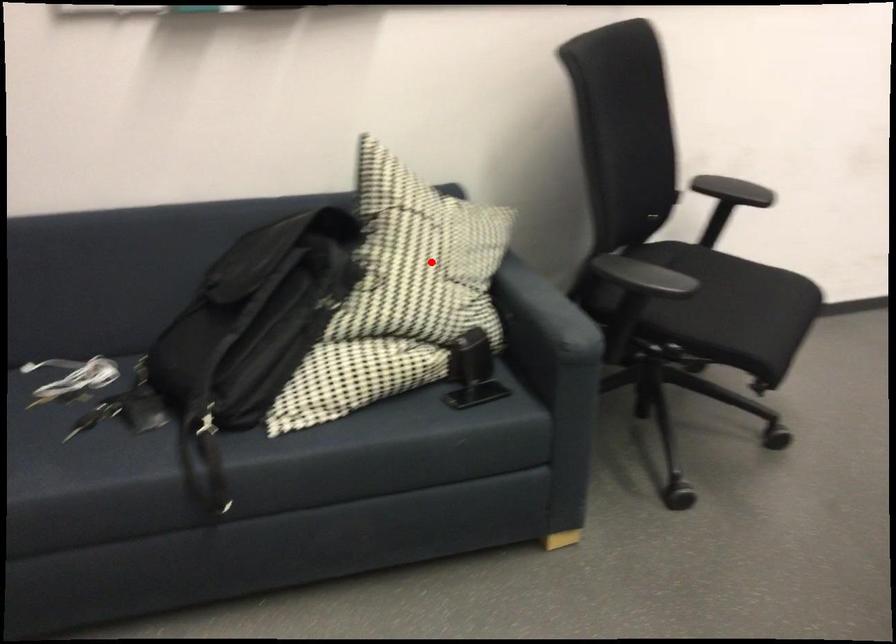
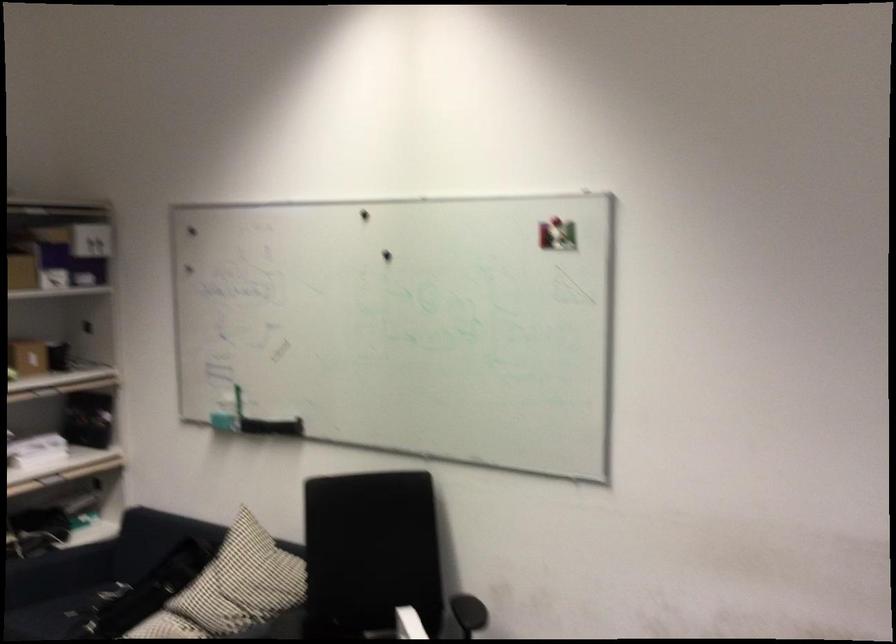
Question: I am providing you with two images of the same scene from different viewpoints. A red point is shown in image1. For the corresponding object point in image2, is it positioned nearer or farther from the camera?

Choices:
 (A) Nearer
 (B) Farther

Answer: (B)